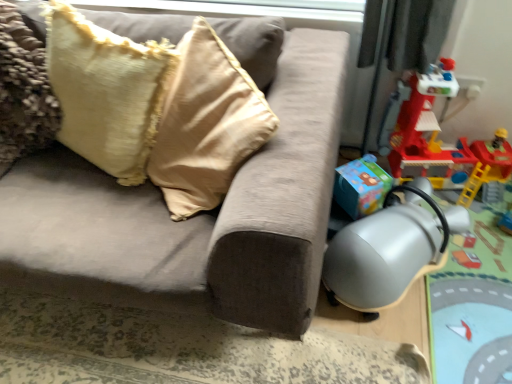
Question: Should I look upward or downward to see silver metallic swivel chair at lower right?

Choices:
 (A) up
 (B) down

Answer: (B)

Question: From a real-world perspective, is silver metallic swivel chair at lower right over suede-like beige couch at center?

Choices:
 (A) no
 (B) yes

Answer: (A)

Question: Can you confirm if silver metallic swivel chair at lower right is shorter than suede-like beige couch at center?

Choices:
 (A) yes
 (B) no

Answer: (A)

Question: Is silver metallic swivel chair at lower right aimed at suede-like beige couch at center?

Choices:
 (A) yes
 (B) no

Answer: (B)

Question: Is silver metallic swivel chair at lower right to the left of suede-like beige couch at center from the viewer's perspective?

Choices:
 (A) no
 (B) yes

Answer: (A)

Question: From the image's perspective, is silver metallic swivel chair at lower right above suede-like beige couch at center?

Choices:
 (A) yes
 (B) no

Answer: (B)

Question: Is silver metallic swivel chair at lower right taller than suede-like beige couch at center?

Choices:
 (A) no
 (B) yes

Answer: (A)

Question: Does rubberized red playset at right have a greater width compared to suede-like beige couch at center?

Choices:
 (A) yes
 (B) no

Answer: (B)

Question: Does rubberized red playset at right have a larger size compared to suede-like beige couch at center?

Choices:
 (A) no
 (B) yes

Answer: (A)

Question: From a real-world perspective, is rubberized red playset at right located beneath suede-like beige couch at center?

Choices:
 (A) yes
 (B) no

Answer: (A)

Question: Considering the relative sizes of rubberized red playset at right and suede-like beige couch at center in the image provided, is rubberized red playset at right taller than suede-like beige couch at center?

Choices:
 (A) yes
 (B) no

Answer: (A)

Question: Is rubberized red playset at right far from suede-like beige couch at center?

Choices:
 (A) no
 (B) yes

Answer: (A)

Question: Does rubberized red playset at right come behind suede-like beige couch at center?

Choices:
 (A) yes
 (B) no

Answer: (A)

Question: Are velvet beige pillow at upper left and rubberized red playset at right making contact?

Choices:
 (A) yes
 (B) no

Answer: (B)